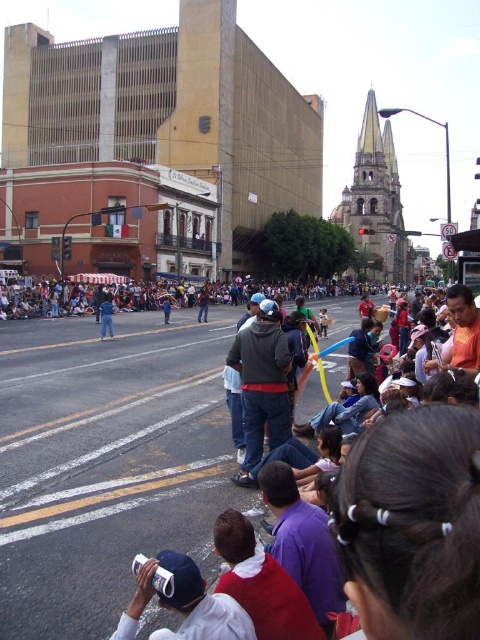
Question: Which object is farther from the camera taking this photo?

Choices:
 (A) dark gray hoodie at center
 (B) matte plastic balloon at center
 (C) blue denim jeans at center

Answer: (C)

Question: Can you confirm if matte plastic balloon at center is thinner than white matte cap at lower center?

Choices:
 (A) yes
 (B) no

Answer: (B)

Question: Which point is closer to the camera?

Choices:
 (A) blue denim jeans at center
 (B) dark gray hoodie at center
 (C) denim jacket at center

Answer: (B)

Question: Based on their relative distances, which object is farther from the blue denim jeans at center?

Choices:
 (A) denim jacket at center
 (B) white matte cap at lower center
 (C) dark gray hoodie at center
 (D) matte plastic balloon at center

Answer: (B)

Question: Does matte plastic balloon at center appear over white matte cap at lower center?

Choices:
 (A) yes
 (B) no

Answer: (A)

Question: Observing the image, what is the correct spatial positioning of matte plastic balloon at center in reference to white matte cap at lower center?

Choices:
 (A) left
 (B) right

Answer: (A)